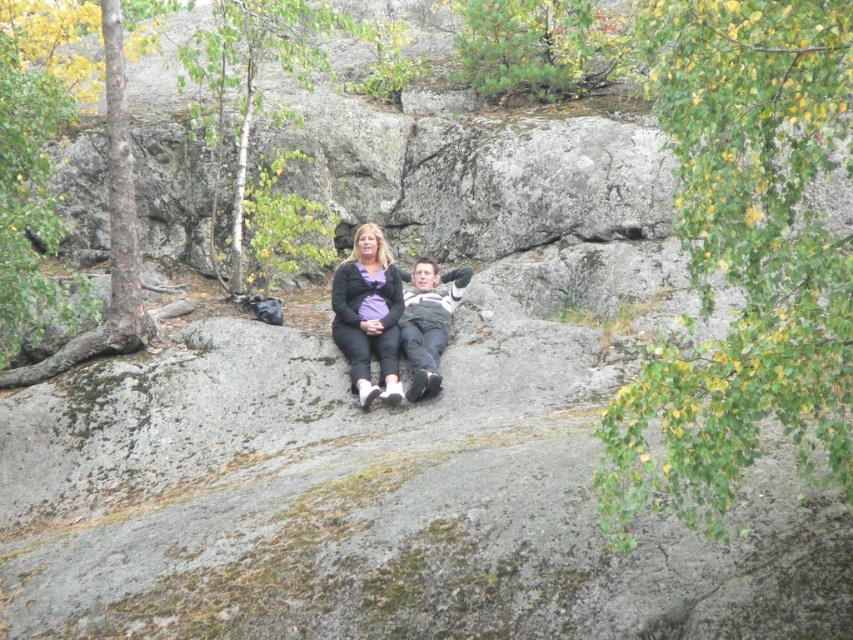
You are standing in the forest scene and want to move from the green rough bark tree at left to the matte gray sweater at center. Which direction should you walk to get there?

You should walk to the right to reach the matte gray sweater at center from the green rough bark tree at left since the tree is positioned to the left of the sweater.

You are planning to take a photo of the green rough bark tree at left and the matte gray sweater at center. Which object is wider in the image?

The green rough bark tree at left is wider than the matte gray sweater at center.